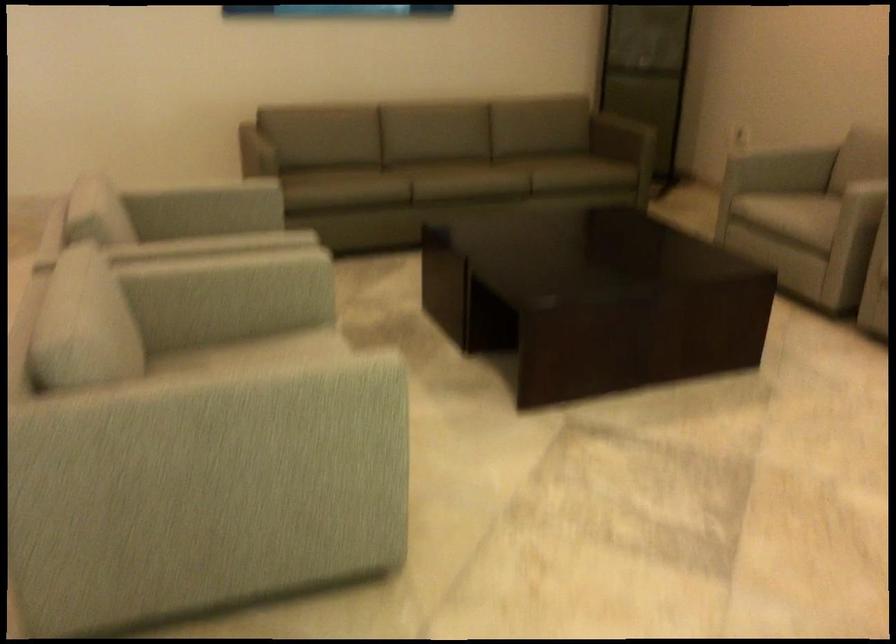
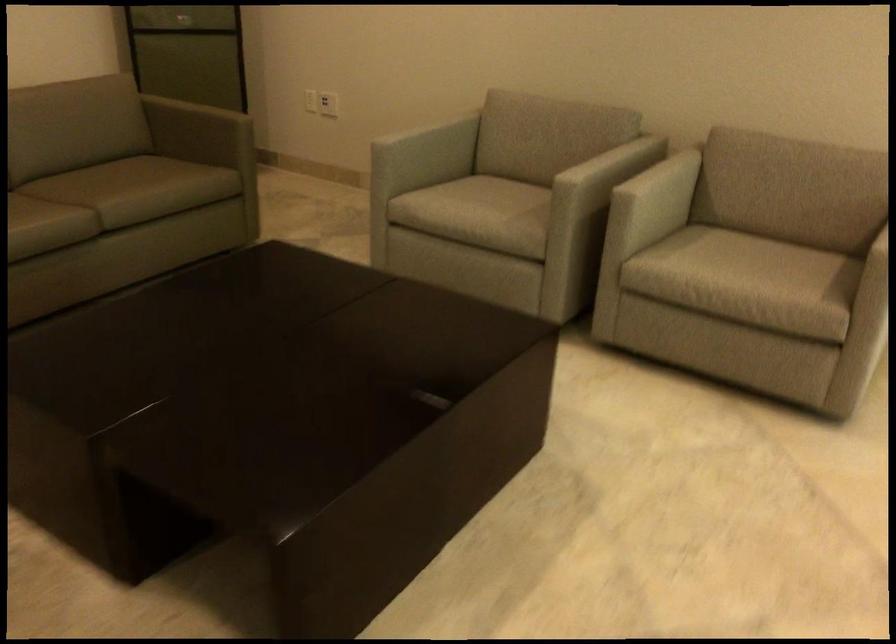
Locate, in the second image, the point that corresponds to pixel 787 212 in the first image.

(480, 207)